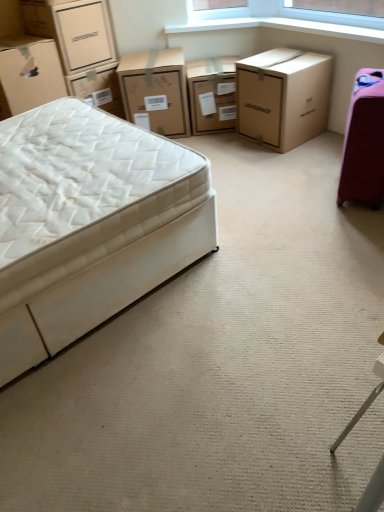
Find the location of a particular element. The width and height of the screenshot is (384, 512). vacant region in front of brown cardboard box at upper right, the first chest of drawers when ordered from right to left is located at coordinates (291, 159).